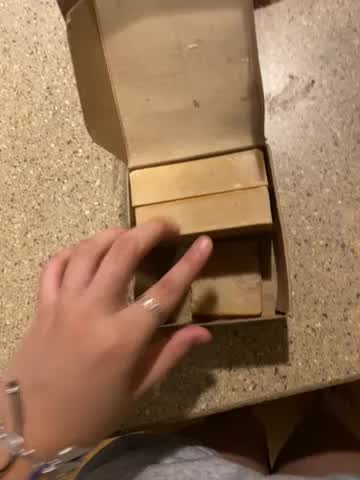
Find the location of a particular element. The height and width of the screenshot is (480, 360). box is located at coordinates (233, 279).